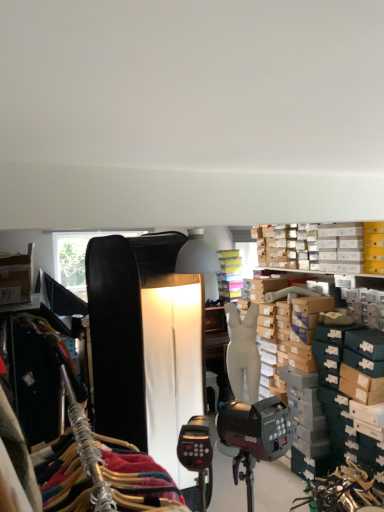
Locate an element on the screen. This screenshot has width=384, height=512. white matte mannequin at center is located at coordinates (243, 352).

Describe the element at coordinates (243, 352) in the screenshot. I see `white matte mannequin at center` at that location.

What do you see at coordinates (318, 247) in the screenshot?
I see `white cardboard boxes at upper right` at bounding box center [318, 247].

You are a GUI agent. You are given a task and a screenshot of the screen. Output one action in this format:
    pyautogui.click(x=<x>, y=<y>)
    Task: Click on the white cardboard boxes at upper right
    
    Given the screenshot: What is the action you would take?
    pyautogui.click(x=318, y=247)

Measure the distance between point (343, 248) and camera.

The distance of point (343, 248) from camera is 12.65 feet.

Where is `white matte mannequin at center`? This screenshot has height=512, width=384. white matte mannequin at center is located at coordinates (243, 352).

Which object is positioned more to the left, white cardboard boxes at upper right or white matte mannequin at center?

white matte mannequin at center is more to the left.

Is the depth of white cardboard boxes at upper right greater than that of white matte mannequin at center?

No, it is in front of white matte mannequin at center.

Considering the points (260, 264) and (249, 346), which point is in front, point (260, 264) or point (249, 346)?

The point (249, 346) is closer.

Based on the photo, from the image's perspective, does white cardboard boxes at upper right appear lower than white matte mannequin at center?

Actually, white cardboard boxes at upper right appears above white matte mannequin at center in the image.

From a real-world perspective, is white cardboard boxes at upper right located beneath white matte mannequin at center?

No, from a real-world perspective, white cardboard boxes at upper right is not beneath white matte mannequin at center.

Between white cardboard boxes at upper right and white matte mannequin at center, which one has smaller width?

white matte mannequin at center.

Is white cardboard boxes at upper right taller or shorter than white matte mannequin at center?

white cardboard boxes at upper right is shorter than white matte mannequin at center.

Considering the relative sizes of white cardboard boxes at upper right and white matte mannequin at center in the image provided, is white cardboard boxes at upper right bigger than white matte mannequin at center?

No, white cardboard boxes at upper right is not bigger than white matte mannequin at center.

Is white cardboard boxes at upper right not inside white matte mannequin at center?

That's correct, white cardboard boxes at upper right is outside of white matte mannequin at center.

Looking at this image, is white cardboard boxes at upper right not near white matte mannequin at center?

Indeed, white cardboard boxes at upper right is not near white matte mannequin at center.

Is white cardboard boxes at upper right positioned with its back to white matte mannequin at center?

white cardboard boxes at upper right is not turned away from white matte mannequin at center.

How different are the orientations of white cardboard boxes at upper right and white matte mannequin at center in degrees?

54.4 degrees.

How distant is white cardboard boxes at upper right from white matte mannequin at center?

The distance of white cardboard boxes at upper right from white matte mannequin at center is 3.36 feet.

Where is `mannequin below the white cardboard boxes at upper right (from the image's perspective)`? mannequin below the white cardboard boxes at upper right (from the image's perspective) is located at coordinates (243, 352).

Which object is positioned more to the right, white matte mannequin at center or white cardboard boxes at upper right?

Positioned to the right is white cardboard boxes at upper right.

Which object is further away from the camera taking this photo, white matte mannequin at center or white cardboard boxes at upper right?

Positioned behind is white matte mannequin at center.

Which is in front, point (230, 332) or point (258, 234)?

Point (230, 332)

From the image's perspective, which one is positioned higher, white matte mannequin at center or white cardboard boxes at upper right?

white cardboard boxes at upper right is shown above in the image.

From a real-world perspective, between white matte mannequin at center and white cardboard boxes at upper right, who is vertically lower?

In real-world perspective, white matte mannequin at center is lower.

In the scene shown: Between white matte mannequin at center and white cardboard boxes at upper right, which one has larger width?

white cardboard boxes at upper right.

Can you confirm if white matte mannequin at center is shorter than white cardboard boxes at upper right?

In fact, white matte mannequin at center may be taller than white cardboard boxes at upper right.

Considering the relative sizes of white matte mannequin at center and white cardboard boxes at upper right in the image provided, is white matte mannequin at center smaller than white cardboard boxes at upper right?

No.

Is white matte mannequin at center not within white cardboard boxes at upper right?

white matte mannequin at center lies outside white cardboard boxes at upper right's area.

Based on the photo, is white matte mannequin at center in contact with white cardboard boxes at upper right?

No, white matte mannequin at center is not with white cardboard boxes at upper right.

Could you tell me if white matte mannequin at center is facing white cardboard boxes at upper right?

No, white matte mannequin at center is not turned towards white cardboard boxes at upper right.

How many degrees apart are the facing directions of white matte mannequin at center and white cardboard boxes at upper right?

The angular difference between white matte mannequin at center and white cardboard boxes at upper right is 54.4 degrees.

This screenshot has width=384, height=512. In the image, there is a white cardboard boxes at upper right. What are the coordinates of `mannequin below it (from a real-world perspective)` in the screenshot? It's located at (243, 352).

Locate an element on the screen. Image resolution: width=384 pixels, height=512 pixels. shelf on the right side of white matte mannequin at center is located at coordinates (318, 247).

Where is `mannequin below the white cardboard boxes at upper right (from a real-world perspective)`? mannequin below the white cardboard boxes at upper right (from a real-world perspective) is located at coordinates (243, 352).